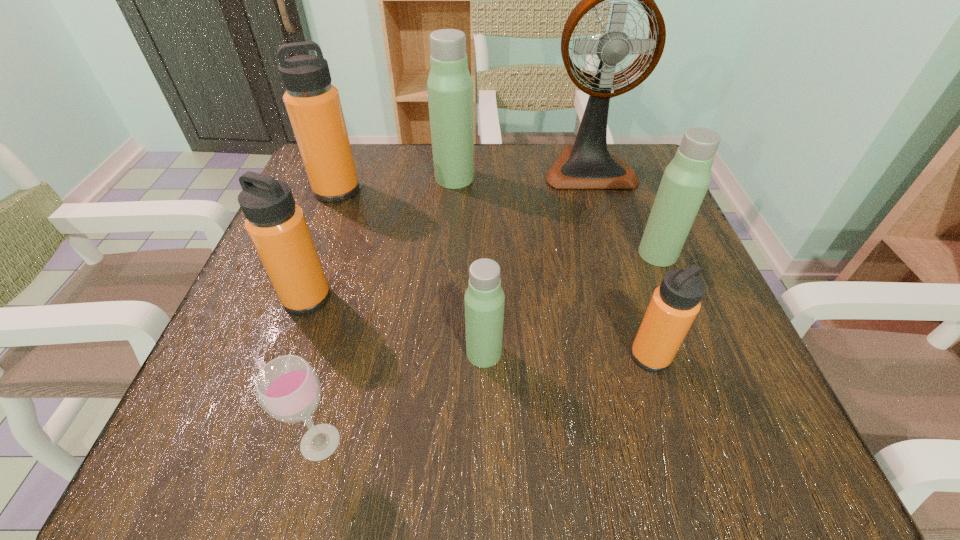
Locate an element on the screen. The height and width of the screenshot is (540, 960). vacant space positioned on the right of the wineglass is located at coordinates (568, 442).

This screenshot has width=960, height=540. What are the coordinates of `fan situated at the far edge` in the screenshot? It's located at (587, 164).

Locate an element on the screen. The width and height of the screenshot is (960, 540). object that is positioned at the near edge is located at coordinates (288, 388).

You are a GUI agent. You are given a task and a screenshot of the screen. Output one action in this format:
    pyautogui.click(x=<x>, y=<y>)
    Task: Click on the wineglass present at the left edge
    This screenshot has height=540, width=960.
    Given the screenshot: What is the action you would take?
    pyautogui.click(x=288, y=388)

Locate an element on the screen. The image size is (960, 540). fan present at the right edge is located at coordinates (587, 164).

Find the location of a particular element. This screenshot has width=960, height=540. object located in the far left corner section of the desktop is located at coordinates (313, 104).

Locate an element on the screen. The width and height of the screenshot is (960, 540). object that is at the near left corner is located at coordinates point(288,388).

Locate an element on the screen. This screenshot has height=540, width=960. object at the far right corner is located at coordinates (587, 164).

At what (x,y) coordinates should I click in order to perform the action: click on vacant position at the far edge of the desktop. Please return your answer as a coordinate pair (x, y). The width and height of the screenshot is (960, 540). Looking at the image, I should click on (423, 195).

Locate an element on the screen. This screenshot has width=960, height=540. free location at the near edge is located at coordinates (552, 428).